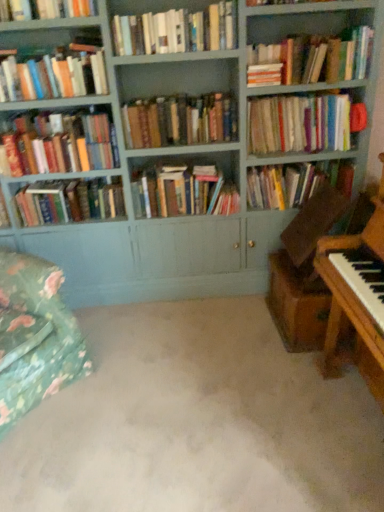
Question: Should I look upward or downward to see hardcover book at upper left, arranged as the 2th book when viewed from the left?

Choices:
 (A) up
 (B) down

Answer: (A)

Question: Is hardcover books at center, the fourth book when ordered from right to left, completely or partially inside matte hardcover book at left, the 4th book positioned from the left?

Choices:
 (A) yes
 (B) no

Answer: (B)

Question: From a real-world perspective, does matte hardcover book at left, the 7th book positioned from the right, sit lower than hardcover books at center, the 7th book when ordered from left to right?

Choices:
 (A) yes
 (B) no

Answer: (A)

Question: Does matte hardcover book at left, the 7th book positioned from the right, come behind hardcover books at center, the 7th book when ordered from left to right?

Choices:
 (A) yes
 (B) no

Answer: (A)

Question: From the image's perspective, is matte hardcover book at left, the 7th book positioned from the right, located beneath hardcover books at center, the 7th book when ordered from left to right?

Choices:
 (A) no
 (B) yes

Answer: (B)

Question: Is matte hardcover book at left, the 4th book positioned from the left, not within hardcover books at center, the fourth book when ordered from right to left?

Choices:
 (A) yes
 (B) no

Answer: (A)

Question: Can you confirm if matte hardcover book at left, the 7th book positioned from the right, is positioned to the right of hardcover books at center, the 7th book when ordered from left to right?

Choices:
 (A) no
 (B) yes

Answer: (A)

Question: From the image's perspective, would you say hardcover book at center, marked as the 10th book in a left-to-right arrangement, is shown under hardcover books at upper center, marked as the 6th book in a right-to-left arrangement?

Choices:
 (A) yes
 (B) no

Answer: (A)

Question: From the image's perspective, is hardcover book at center, marked as the 10th book in a left-to-right arrangement, on top of hardcover books at upper center, marked as the 6th book in a right-to-left arrangement?

Choices:
 (A) no
 (B) yes

Answer: (A)

Question: From a real-world perspective, is hardcover book at center, marked as the 10th book in a left-to-right arrangement, beneath hardcover books at upper center, arranged as the fifth book when viewed from the left?

Choices:
 (A) yes
 (B) no

Answer: (A)

Question: Is hardcover book at center, marked as the 10th book in a left-to-right arrangement, taller than hardcover books at upper center, arranged as the fifth book when viewed from the left?

Choices:
 (A) yes
 (B) no

Answer: (A)

Question: Does hardcover book at center, marked as the 10th book in a left-to-right arrangement, have a greater width compared to hardcover books at upper center, arranged as the fifth book when viewed from the left?

Choices:
 (A) no
 (B) yes

Answer: (B)

Question: Is hardcover book at center, marked as the 10th book in a left-to-right arrangement, further to camera compared to hardcover books at upper center, arranged as the fifth book when viewed from the left?

Choices:
 (A) no
 (B) yes

Answer: (B)

Question: Does hardcover book at upper left, arranged as the 2th book when viewed from the left, have a smaller size compared to hardcover books at upper right, the 3th book viewed from the right?

Choices:
 (A) yes
 (B) no

Answer: (A)